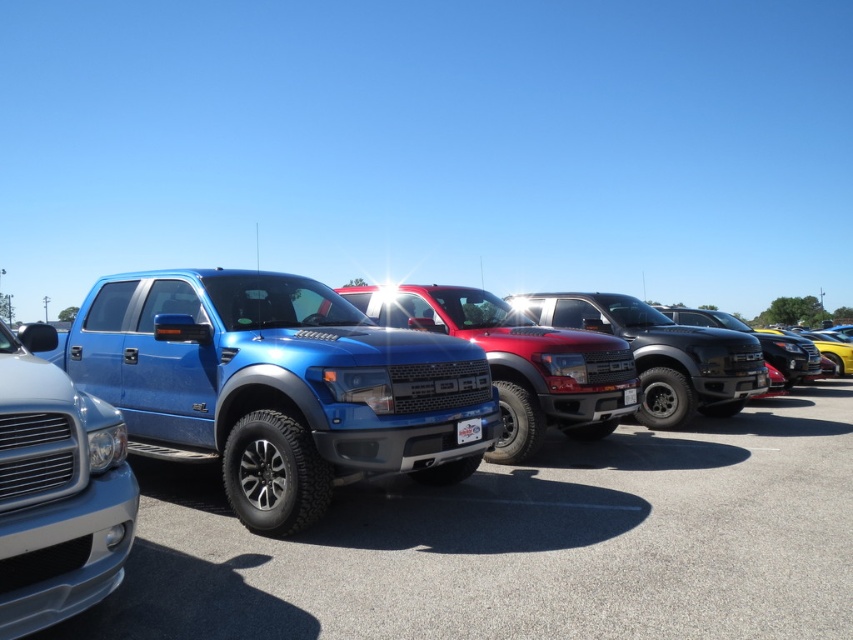
You are a delivery driver who needs to park your 2.5 meter wide truck in the dealership lot. The lot has a narrow parking space that can only accommodate vehicles up to 2.3 meters in width. You see the satin silver truck at center and the shiny red truck at center parked there. Which truck, if either, would you choose to park your vehicle next to to ensure enough space?

The satin silver truck at center is thinner than the shiny red truck at center, so the satin silver truck at center takes up less space. Therefore, parking next to the satin silver truck at center would leave more room for your 2.5 meter wide truck, but since the parking space only allows up to 2.3 meters, your truck may still be too wide to fit.

You are a delivery person needing to park your 2.5 meter wide delivery van between the metallic blue pickup truck at center and the satin silver truck at center. Can your van fit in the space between them?

The metallic blue pickup truck at center is wider than the satin silver truck at center. However, the question is about the space between them, not their widths. Since the description only provides information about their widths and not the distance between them, we cannot determine if the van can fit based on the given information.